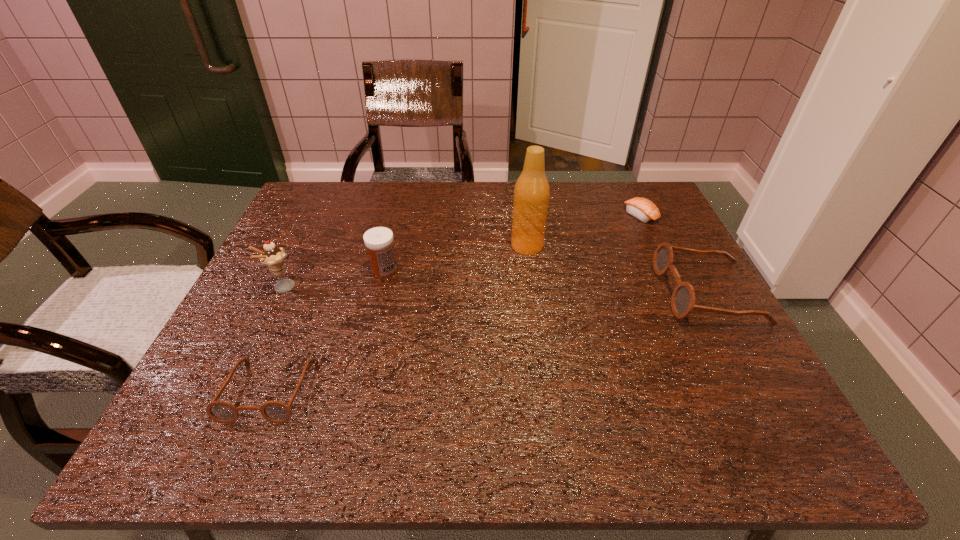
Find the location of a particular element. free space between the icecream and the nearest object is located at coordinates (276, 339).

Locate which object is the fourth closest to the shortest object. Please provide its 2D coordinates. Your answer should be formatted as a tuple, i.e. [(x, y)], where the tuple contains the x and y coordinates of a point satisfying the conditions above.

[(277, 412)]

Point out which object is positioned as the second nearest to the fifth shortest object. Please provide its 2D coordinates. Your answer should be formatted as a tuple, i.e. [(x, y)], where the tuple contains the x and y coordinates of a point satisfying the conditions above.

[(277, 412)]